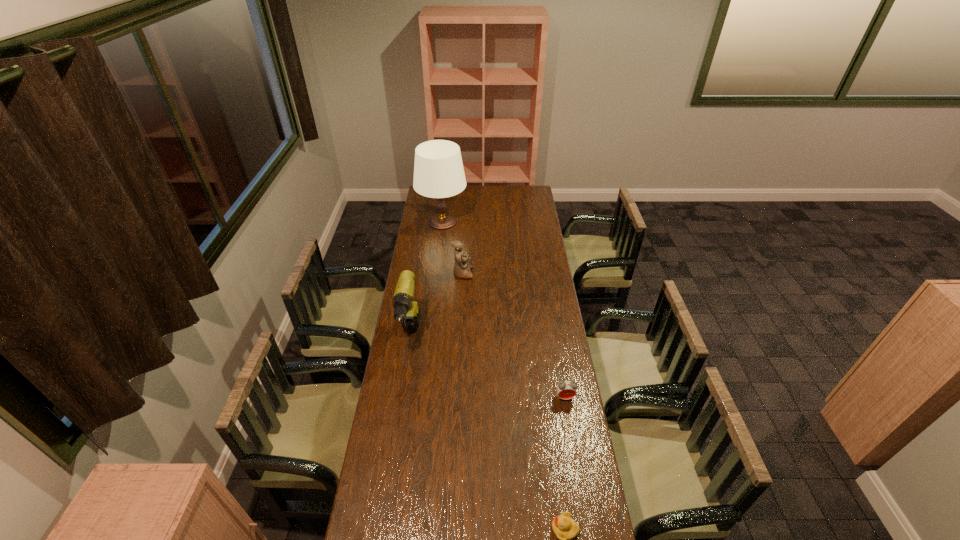
This screenshot has width=960, height=540. Find the location of `vacant position located 0.130m on the front-facing side of the figurine`. vacant position located 0.130m on the front-facing side of the figurine is located at coordinates (498, 273).

Where is `free space located 0.310m on the face of the fourth tallest object`? The image size is (960, 540). free space located 0.310m on the face of the fourth tallest object is located at coordinates (579, 483).

Identify the location of lamp located in the left edge section of the desktop. (438, 169).

What are the coordinates of `drill located at the left edge` in the screenshot? It's located at (407, 311).

At what (x,y) coordinates should I click in order to perform the action: click on object at the right edge. Please return your answer as a coordinate pair (x, y). This screenshot has width=960, height=540. Looking at the image, I should click on (566, 389).

Locate an element on the screen. vacant space at the far edge is located at coordinates (491, 191).

What are the coordinates of `vacant space at the left edge of the desktop` in the screenshot? It's located at (427, 248).

Find the location of a particular element. The height and width of the screenshot is (540, 960). free space at the right edge of the desktop is located at coordinates (542, 248).

The width and height of the screenshot is (960, 540). Identify the location of blank space at the far right corner. (538, 200).

You are a GUI agent. You are given a task and a screenshot of the screen. Output one action in this format:
    pyautogui.click(x=<x>, y=<y>)
    Task: Click on the free space between the fourth nearest object and the fourth tallest object
    
    Given the screenshot: What is the action you would take?
    pyautogui.click(x=514, y=335)